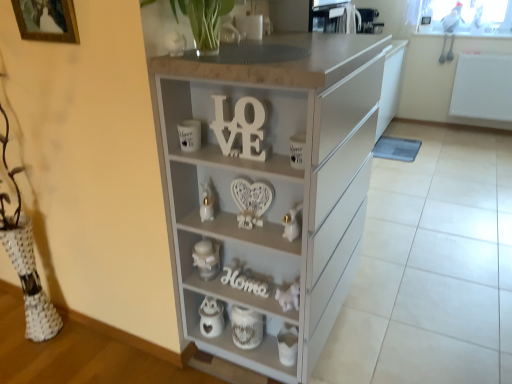
Question: Considering the relative positions of wooden framed picture at upper left and white glossy rabbit at lower center, the first toy from the right, in the image provided, is wooden framed picture at upper left in front of white glossy rabbit at lower center, the first toy from the right,?

Choices:
 (A) no
 (B) yes

Answer: (B)

Question: From a real-world perspective, is wooden framed picture at upper left on white glossy rabbit at lower center, the 2th toy viewed from the left?

Choices:
 (A) no
 (B) yes

Answer: (B)

Question: Considering the relative positions of wooden framed picture at upper left and white glossy rabbit at lower center, the first toy from the right, in the image provided, is wooden framed picture at upper left to the left of white glossy rabbit at lower center, the first toy from the right, from the viewer's perspective?

Choices:
 (A) no
 (B) yes

Answer: (B)

Question: Considering the relative sizes of wooden framed picture at upper left and white glossy rabbit at lower center, the 2th toy viewed from the left, in the image provided, is wooden framed picture at upper left taller than white glossy rabbit at lower center, the 2th toy viewed from the left,?

Choices:
 (A) yes
 (B) no

Answer: (A)

Question: From a real-world perspective, is wooden framed picture at upper left positioned under white glossy rabbit at lower center, which appears as the first toy when viewed from the front, based on gravity?

Choices:
 (A) yes
 (B) no

Answer: (B)

Question: Considering the relative positions of wooden framed picture at upper left and white glossy rabbit at lower center, the second toy in the back-to-front sequence, in the image provided, is wooden framed picture at upper left behind white glossy rabbit at lower center, the second toy in the back-to-front sequence,?

Choices:
 (A) no
 (B) yes

Answer: (A)

Question: Can you confirm if white glossy owl at lower center, acting as the 2th appliance starting from the front, is wider than white glossy rabbit at center, placed as the 2th toy when sorted from right to left?

Choices:
 (A) yes
 (B) no

Answer: (B)

Question: Is white glossy owl at lower center, arranged as the 3th appliance when viewed from the top, further to the viewer compared to white glossy rabbit at center, which appears as the first toy when viewed from the left?

Choices:
 (A) no
 (B) yes

Answer: (B)

Question: Can you confirm if white glossy owl at lower center, the 2th appliance viewed from the left, is thinner than white glossy rabbit at center, which appears as the first toy when viewed from the left?

Choices:
 (A) no
 (B) yes

Answer: (B)

Question: Does white glossy owl at lower center, acting as the 2th appliance starting from the front, have a lesser height compared to white glossy rabbit at center, which appears as the first toy when viewed from the left?

Choices:
 (A) no
 (B) yes

Answer: (A)

Question: Is white glossy owl at lower center, arranged as the 3th appliance when viewed from the top, completely or partially outside of white glossy rabbit at center, marked as the first toy in a back-to-front arrangement?

Choices:
 (A) no
 (B) yes

Answer: (B)

Question: Can you confirm if white glossy owl at lower center, the 2th appliance viewed from the left, is positioned to the right of white glossy rabbit at center, which appears as the first toy when viewed from the left?

Choices:
 (A) yes
 (B) no

Answer: (B)

Question: Is white textured ceramic jar at lower center turned away from white glossy rabbit at center, marked as the first toy in a back-to-front arrangement?

Choices:
 (A) no
 (B) yes

Answer: (A)